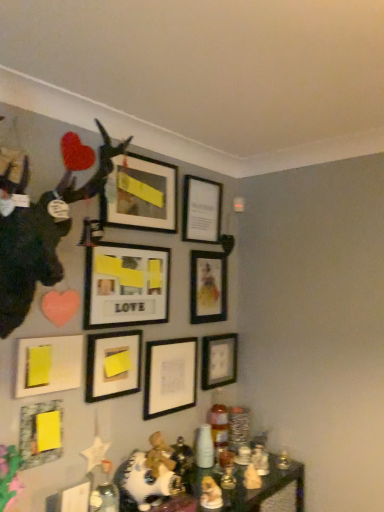
Question: Is matte black picture frame at center, which appears as the eighth picture frame when viewed from the top, closer to camera compared to matte black picture frame at upper center, which is the ninth picture frame from bottom to top?

Choices:
 (A) yes
 (B) no

Answer: (B)

Question: Is matte black picture frame at center, which appears as the eighth picture frame when viewed from the top, oriented towards matte black picture frame at upper center, which ranks as the 1th picture frame in top-to-bottom order?

Choices:
 (A) no
 (B) yes

Answer: (A)

Question: Is matte black picture frame at center, which is the 2th picture frame from bottom to top, further to the viewer compared to matte black picture frame at upper center, which ranks as the 1th picture frame in top-to-bottom order?

Choices:
 (A) no
 (B) yes

Answer: (B)

Question: Is matte black picture frame at center, which is the 2th picture frame from bottom to top, touching matte black picture frame at upper center, which is the ninth picture frame from bottom to top?

Choices:
 (A) yes
 (B) no

Answer: (B)

Question: Can you confirm if matte black picture frame at center, which is the 2th picture frame from bottom to top, is smaller than matte black picture frame at upper center, which is the ninth picture frame from bottom to top?

Choices:
 (A) no
 (B) yes

Answer: (B)

Question: Considering the relative positions of matte black picture frame at center, which is the 2th picture frame from bottom to top, and matte black picture frame at upper center, which is the ninth picture frame from bottom to top, in the image provided, is matte black picture frame at center, which is the 2th picture frame from bottom to top, to the left of matte black picture frame at upper center, which is the ninth picture frame from bottom to top, from the viewer's perspective?

Choices:
 (A) yes
 (B) no

Answer: (B)

Question: Considering the relative positions of matte black picture frame at upper center, which ranks as the 1th picture frame in top-to-bottom order, and matte black picture frame at center-right, which is the sixth picture frame from bottom to top, in the image provided, is matte black picture frame at upper center, which ranks as the 1th picture frame in top-to-bottom order, in front of matte black picture frame at center-right, which is the sixth picture frame from bottom to top,?

Choices:
 (A) yes
 (B) no

Answer: (A)

Question: Does matte black picture frame at upper center, which is the ninth picture frame from bottom to top, turn towards matte black picture frame at center-right, which is the sixth picture frame from bottom to top?

Choices:
 (A) yes
 (B) no

Answer: (B)

Question: From the image's perspective, does matte black picture frame at upper center, which is the ninth picture frame from bottom to top, appear higher than matte black picture frame at center-right, which is the sixth picture frame from bottom to top?

Choices:
 (A) no
 (B) yes

Answer: (B)

Question: Is matte black picture frame at upper center, which is the ninth picture frame from bottom to top, not close to matte black picture frame at center-right, marked as the 4th picture frame in a top-to-bottom arrangement?

Choices:
 (A) no
 (B) yes

Answer: (A)

Question: Does matte black picture frame at upper center, which is the ninth picture frame from bottom to top, have a lesser height compared to matte black picture frame at center-right, which is the sixth picture frame from bottom to top?

Choices:
 (A) yes
 (B) no

Answer: (A)

Question: Can you confirm if matte black picture frame at upper center, which ranks as the 1th picture frame in top-to-bottom order, is positioned to the left of matte black picture frame at center-right, which is the sixth picture frame from bottom to top?

Choices:
 (A) yes
 (B) no

Answer: (A)

Question: Is yellow matte picture frame at lower left, the first picture frame positioned from the bottom, wider than matte black picture frame at lower right, placed as the 3th picture frame when sorted from bottom to top?

Choices:
 (A) yes
 (B) no

Answer: (B)